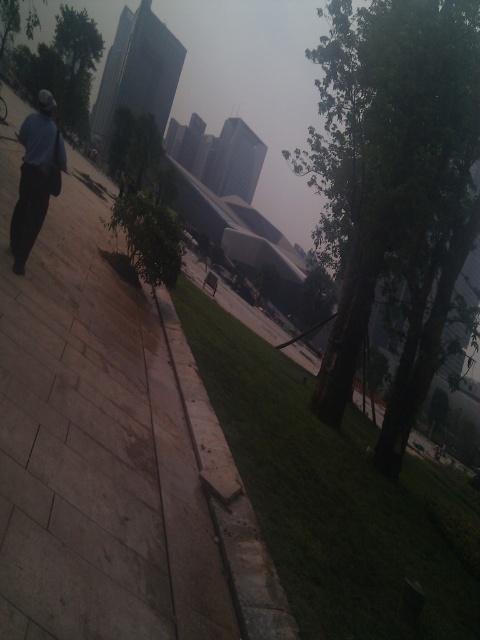
You are standing at the point marked by the coordinates point (x=95, y=445) in the urban park scene. What is the nearest object to you?

The nearest object to you is the light brown stone pavement at center, as it is represented by the coordinates point (x=95, y=445).

You are a delivery person trying to navigate a narrow path in the park. You have a cart that can only go over surfaces wider than 2 meters. The light brown stone pavement at center and the gray concrete curb at center are in your way. Which surface should you choose to pass through?

The light brown stone pavement at center is positioned over the gray concrete curb at center, so it is wider and can accommodate the cart.

You are standing at the position of the dark blue shirt at left and want to walk to the light brown stone pavement at center. How many steps would you need to take if each step covers approximately 2.5 feet?

The distance between the dark blue shirt at left and the light brown stone pavement at center is 6.51 feet. Since each step covers about 2.5 feet, you would need approximately 3 steps to reach the light brown stone pavement at center.